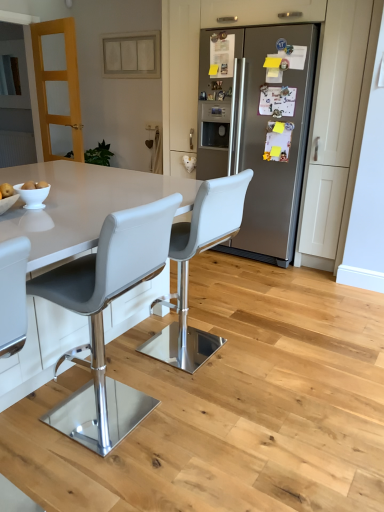
Where is `yellow matte apple at lower left`? This screenshot has height=512, width=384. yellow matte apple at lower left is located at coordinates (6, 190).

What do you see at coordinates (260, 131) in the screenshot? The width and height of the screenshot is (384, 512). I see `satin silver refrigerator at center` at bounding box center [260, 131].

In order to face white leather stool at center, the second chair positioned from the back, should I rotate leftwards or rightwards?

You should rotate left by 11.440 degrees.

Image resolution: width=384 pixels, height=512 pixels. What do you see at coordinates (102, 318) in the screenshot?
I see `white leather stool at center, the second chair positioned from the back` at bounding box center [102, 318].

The height and width of the screenshot is (512, 384). What do you see at coordinates (58, 80) in the screenshot?
I see `light brown wooden door at upper left` at bounding box center [58, 80].

Identify the location of yellow matte apple at lower left. (6, 190).

Does white glossy bowl at lower left have a greater width compared to white leather stool at center, the second chair positioned from the back?

No, white glossy bowl at lower left is not wider than white leather stool at center, the second chair positioned from the back.

Consider the image. Is white glossy bowl at lower left aimed at white leather stool at center, arranged as the first chair when viewed from the front?

Yes, white glossy bowl at lower left is facing white leather stool at center, arranged as the first chair when viewed from the front.

Is white glossy bowl at lower left to the right of white leather stool at center, the second chair positioned from the back, from the viewer's perspective?

No.

From a real-world perspective, which is physically above, white glossy bowl at lower left or white leather stool at center, arranged as the first chair when viewed from the front?

From a 3D spatial view, white glossy bowl at lower left is above.

Measure the distance from white glossy bowl at lower left to satin silver refrigerator at center.

They are 2.09 meters apart.

Which of these two, white glossy bowl at lower left or satin silver refrigerator at center, stands shorter?

white glossy bowl at lower left.

Is the surface of white glossy bowl at lower left in direct contact with satin silver refrigerator at center?

white glossy bowl at lower left is not next to satin silver refrigerator at center, and they're not touching.

Which point is more distant from viewer, (47,193) or (278,68)?

The point (278,68) is more distant.

How different are the orientations of beige matte cabinet at upper center and yellow matte apple at lower left in degrees?

They differ by 89.9 degrees in their facing directions.

Which is in front, point (105, 74) or point (7, 189)?

The point (7, 189) is more forward.

From the image's perspective, who appears lower, beige matte cabinet at upper center or yellow matte apple at lower left?

yellow matte apple at lower left, from the image's perspective.

Can you confirm if beige matte cabinet at upper center is bigger than yellow matte apple at lower left?

Indeed, beige matte cabinet at upper center has a larger size compared to yellow matte apple at lower left.

Would you say beige matte cabinet at upper center is outside satin silver refrigerator at center?

That's correct, beige matte cabinet at upper center is outside of satin silver refrigerator at center.

How different are the orientations of beige matte cabinet at upper center and satin silver refrigerator at center in degrees?

0.86 degrees.

From the picture: How much distance is there between beige matte cabinet at upper center and satin silver refrigerator at center?

beige matte cabinet at upper center is 1.63 meters from satin silver refrigerator at center.

Considering the relative sizes of beige matte cabinet at upper center and satin silver refrigerator at center in the image provided, is beige matte cabinet at upper center bigger than satin silver refrigerator at center?

No.

In terms of height, does white leather stool at center, which is the 2th chair in front-to-back order, look taller or shorter compared to beige matte cabinet at upper center?

Clearly, white leather stool at center, which is the 2th chair in front-to-back order, is taller compared to beige matte cabinet at upper center.

Image resolution: width=384 pixels, height=512 pixels. Identify the location of the 2nd chair to the right of the beige matte cabinet at upper center, counting from the anchor's position. (188, 268).

Which of these two, white leather stool at center, which appears as the 1th chair when viewed from the back, or beige matte cabinet at upper center, is smaller?

beige matte cabinet at upper center.

Does light brown wooden door at upper left contain yellow matte apple at lower left?

That's incorrect, yellow matte apple at lower left is not inside light brown wooden door at upper left.

Could you tell me if light brown wooden door at upper left is turned towards yellow matte apple at lower left?

No, light brown wooden door at upper left is not oriented towards yellow matte apple at lower left.

From a real-world perspective, which object rests below the other?

From a 3D spatial view, yellow matte apple at lower left is below.

Is light brown wooden door at upper left not near yellow matte apple at lower left?

Yes, light brown wooden door at upper left and yellow matte apple at lower left are located far from each other.

Based on the photo, which is correct: white glossy bowl at lower left is inside white leather stool at center, which is the 2th chair in front-to-back order, or outside of it?

white glossy bowl at lower left is located beyond the bounds of white leather stool at center, which is the 2th chair in front-to-back order.

Is point (28, 195) closer to viewer compared to point (215, 217)?

Yes, it is.

How many degrees apart are the facing directions of white glossy bowl at lower left and white leather stool at center, which is the 2th chair in front-to-back order?

177 degrees separate the facing orientations of white glossy bowl at lower left and white leather stool at center, which is the 2th chair in front-to-back order.

The width and height of the screenshot is (384, 512). In order to click on bowl behind the white leather stool at center, the second chair positioned from the back in this screenshot , I will do `click(33, 196)`.

The width and height of the screenshot is (384, 512). I want to click on refrigerator above the white glossy bowl at lower left (from the image's perspective), so click(260, 131).

Looking at the image, which one is located closer to yellow matte apple at lower left, white leather stool at center, which appears as the 1th chair when viewed from the back, or white glossy bowl at lower left?

white glossy bowl at lower left is positioned closer to the anchor yellow matte apple at lower left.

Estimate the real-world distances between objects in this image. Which object is closer to yellow matte apple at lower left, white leather stool at center, arranged as the first chair when viewed from the front, or white leather stool at center, which is the 2th chair in front-to-back order?

white leather stool at center, arranged as the first chair when viewed from the front, is closer to yellow matte apple at lower left.

Considering their positions, is white leather stool at center, which is the 2th chair in front-to-back order, positioned further to white leather stool at center, the second chair positioned from the back, than satin silver refrigerator at center?

satin silver refrigerator at center is positioned further to the anchor white leather stool at center, the second chair positioned from the back.

In the scene shown: When comparing their distances from yellow matte apple at lower left, does beige matte cabinet at upper center or white leather stool at center, the second chair positioned from the back, seem further?

The object further to yellow matte apple at lower left is beige matte cabinet at upper center.

Which object lies nearer to the anchor point white glossy bowl at lower left, beige matte cabinet at upper center or light brown wooden door at upper left?

light brown wooden door at upper left is positioned closer to the anchor white glossy bowl at lower left.

Based on their spatial positions, is white leather stool at center, arranged as the first chair when viewed from the front, or beige matte cabinet at upper center closer to yellow matte apple at lower left?

white leather stool at center, arranged as the first chair when viewed from the front, is closer to yellow matte apple at lower left.

Considering their positions, is beige matte cabinet at upper center positioned further to white leather stool at center, the second chair positioned from the back, than satin silver refrigerator at center?

beige matte cabinet at upper center lies further to white leather stool at center, the second chair positioned from the back, than the other object.

From the picture: When comparing their distances from light brown wooden door at upper left, does beige matte cabinet at upper center or yellow matte apple at lower left seem closer?

beige matte cabinet at upper center.

This screenshot has height=512, width=384. What are the coordinates of `chair between white glossy bowl at lower left and light brown wooden door at upper left along the z-axis` in the screenshot? It's located at (188, 268).

This screenshot has width=384, height=512. In order to click on bowl between white leather stool at center, arranged as the first chair when viewed from the front, and light brown wooden door at upper left in the front-back direction in this screenshot , I will do `click(33, 196)`.

Locate an element on the screen. bowl located between yellow matte apple at lower left and satin silver refrigerator at center in the left-right direction is located at coordinates (33, 196).

The height and width of the screenshot is (512, 384). I want to click on chair between yellow matte apple at lower left and white leather stool at center, which is the 2th chair in front-to-back order, in the horizontal direction, so click(x=102, y=318).